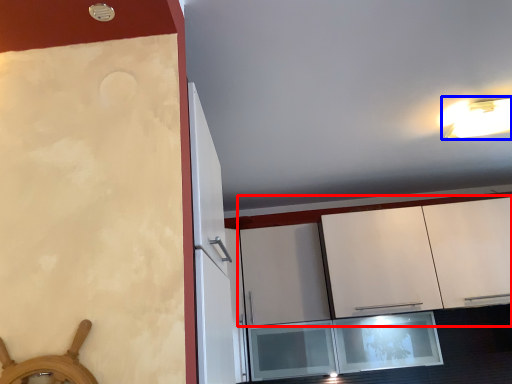
Question: Which object is further to the camera taking this photo, cabinetry (highlighted by a red box) or light fixture (highlighted by a blue box)?

Choices:
 (A) cabinetry
 (B) light fixture

Answer: (A)